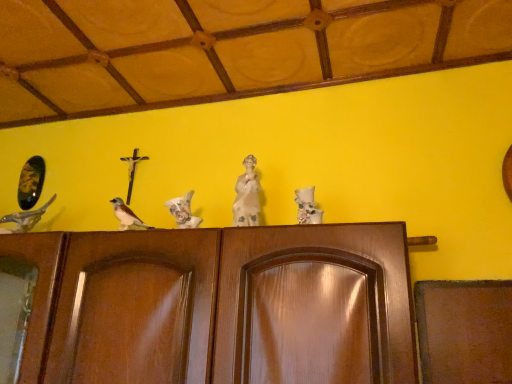
Describe the element at coordinates (247, 196) in the screenshot. Image resolution: width=512 pixels, height=384 pixels. I see `white porcelain statue at center` at that location.

Find the location of `brown matte bird at center, the 2th bird positioned from the left`. brown matte bird at center, the 2th bird positioned from the left is located at coordinates (127, 217).

Considering the sizes of objects brown matte bird at center, the second bird from the right, and white porcelain statue at center in the image provided, who is shorter, brown matte bird at center, the second bird from the right, or white porcelain statue at center?

brown matte bird at center, the second bird from the right, is shorter.

Is brown matte bird at center, the second bird from the right, not close to white porcelain statue at center?

No, brown matte bird at center, the second bird from the right, is in close proximity to white porcelain statue at center.

Can you confirm if brown matte bird at center, the 2th bird positioned from the left, is thinner than white porcelain statue at center?

Incorrect, the width of brown matte bird at center, the 2th bird positioned from the left, is not less than that of white porcelain statue at center.

Which object is thinner, brown matte bird at center, the 2th bird positioned from the left, or shiny metallic bird at left, the third bird from the right?

brown matte bird at center, the 2th bird positioned from the left, is thinner.

Is brown matte bird at center, the 2th bird positioned from the left, touching shiny metallic bird at left, the third bird from the right?

No, brown matte bird at center, the 2th bird positioned from the left, is not with shiny metallic bird at left, the third bird from the right.

Find the location of a particular element. This screenshot has height=384, width=512. the 1st bird in front of the shiny metallic bird at left, which is the first bird from left to right, counting from the anchor's position is located at coordinates (127, 217).

Is brown matte bird at center, the second bird from the right, to the left or to the right of shiny metallic bird at left, which is the first bird from left to right, in the image?

Based on their positions, brown matte bird at center, the second bird from the right, is located to the right of shiny metallic bird at left, which is the first bird from left to right.

Between point (121, 227) and point (186, 222), which one is positioned behind?

The point (121, 227) is behind.

How distant is brown matte bird at center, the second bird from the right, from white matte bird at center, which ranks as the 3th bird in left-to-right order?

4.95 inches.

Can you tell me how much brown matte bird at center, the 2th bird positioned from the left, and white matte bird at center, which ranks as the 1th bird in right-to-left order, differ in facing direction?

brown matte bird at center, the 2th bird positioned from the left, and white matte bird at center, which ranks as the 1th bird in right-to-left order, are facing 0.00055 degrees away from each other.

Do you think brown matte bird at center, the second bird from the right, is within white matte bird at center, which ranks as the 1th bird in right-to-left order, or outside of it?

brown matte bird at center, the second bird from the right, lies outside white matte bird at center, which ranks as the 1th bird in right-to-left order.

Is shiny metallic bird at left, the third bird from the right, taller or shorter than brown matte bird at center, the 2th bird positioned from the left?

Considering their sizes, shiny metallic bird at left, the third bird from the right, has more height than brown matte bird at center, the 2th bird positioned from the left.

Which of these two, shiny metallic bird at left, the third bird from the right, or brown matte bird at center, the 2th bird positioned from the left, is wider?

shiny metallic bird at left, the third bird from the right.

Where is `the 1st bird in front when counting from the shiny metallic bird at left, which is the first bird from left to right`? The height and width of the screenshot is (384, 512). the 1st bird in front when counting from the shiny metallic bird at left, which is the first bird from left to right is located at coordinates (127, 217).

Considering the relative sizes of white matte bird at center, which ranks as the 1th bird in right-to-left order, and brown matte bird at center, the 2th bird positioned from the left, in the image provided, is white matte bird at center, which ranks as the 1th bird in right-to-left order, bigger than brown matte bird at center, the 2th bird positioned from the left,?

No, white matte bird at center, which ranks as the 1th bird in right-to-left order, is not bigger than brown matte bird at center, the 2th bird positioned from the left.

At what (x,y) coordinates should I click in order to perform the action: click on bird located on the right of brown matte bird at center, the second bird from the right. Please return your answer as a coordinate pair (x, y). This screenshot has height=384, width=512. Looking at the image, I should click on (183, 211).

Would you say shiny metallic bird at left, the third bird from the right, is outside white porcelain statue at center?

Yes.

From the image's perspective, who appears lower, shiny metallic bird at left, the third bird from the right, or white porcelain statue at center?

→ From the image's view, shiny metallic bird at left, the third bird from the right, is below.

Is point (8, 217) in front of point (250, 193)?

That is False.

Based on the photo, is shiny metallic bird at left, the third bird from the right, not close to white porcelain statue at center?

No, there isn't a large distance between shiny metallic bird at left, the third bird from the right, and white porcelain statue at center.

In the scene shown: Is white porcelain statue at center aimed at white matte bird at center, which ranks as the 1th bird in right-to-left order?

No.

This screenshot has height=384, width=512. Identify the location of sculpture above the white matte bird at center, which ranks as the 3th bird in left-to-right order (from the image's perspective). (247, 196).

Considering the positions of objects white porcelain statue at center and white matte bird at center, which ranks as the 3th bird in left-to-right order, in the image provided, who is behind, white porcelain statue at center or white matte bird at center, which ranks as the 3th bird in left-to-right order,?

white matte bird at center, which ranks as the 3th bird in left-to-right order, is further away from the camera.

Considering the positions of point (252, 197) and point (181, 208), is point (252, 197) closer or farther from the camera than point (181, 208)?

Clearly, point (252, 197) is more distant from the camera than point (181, 208).

Where is `the 2nd bird to the left of the white porcelain statue at center, counting from the anchor's position`? This screenshot has width=512, height=384. the 2nd bird to the left of the white porcelain statue at center, counting from the anchor's position is located at coordinates (127, 217).

There is a shiny metallic bird at left, the third bird from the right. Where is `the 2nd bird below it (from a real-world perspective)`? The image size is (512, 384). the 2nd bird below it (from a real-world perspective) is located at coordinates (127, 217).

Which object lies further to the anchor point shiny metallic bird at left, the third bird from the right, brown matte bird at center, the second bird from the right, or white porcelain statue at center?

The object further to shiny metallic bird at left, the third bird from the right, is white porcelain statue at center.

Estimate the real-world distances between objects in this image. Which object is closer to brown matte bird at center, the second bird from the right, shiny metallic bird at left, the third bird from the right, or white porcelain statue at center?

Based on the image, white porcelain statue at center appears to be nearer to brown matte bird at center, the second bird from the right.

Estimate the real-world distances between objects in this image. Which object is further from white matte bird at center, which ranks as the 3th bird in left-to-right order, shiny metallic bird at left, the third bird from the right, or brown matte bird at center, the 2th bird positioned from the left?

shiny metallic bird at left, the third bird from the right, is positioned further to the anchor white matte bird at center, which ranks as the 3th bird in left-to-right order.

Looking at the image, which one is located further to shiny metallic bird at left, the third bird from the right, white porcelain statue at center or brown matte bird at center, the second bird from the right?

Based on the image, white porcelain statue at center appears to be further to shiny metallic bird at left, the third bird from the right.

Looking at the image, which one is located closer to white porcelain statue at center, shiny metallic bird at left, the third bird from the right, or brown matte bird at center, the 2th bird positioned from the left?

brown matte bird at center, the 2th bird positioned from the left, is positioned closer to the anchor white porcelain statue at center.

Estimate the real-world distances between objects in this image. Which object is closer to shiny metallic bird at left, the third bird from the right, white porcelain statue at center or white matte bird at center, which ranks as the 3th bird in left-to-right order?

white matte bird at center, which ranks as the 3th bird in left-to-right order, is positioned closer to the anchor shiny metallic bird at left, the third bird from the right.

From the image, which object appears to be farther from white porcelain statue at center, white matte bird at center, which ranks as the 1th bird in right-to-left order, or brown matte bird at center, the 2th bird positioned from the left?

brown matte bird at center, the 2th bird positioned from the left.

Which object lies further to the anchor point shiny metallic bird at left, which is the first bird from left to right, white matte bird at center, which ranks as the 1th bird in right-to-left order, or brown matte bird at center, the 2th bird positioned from the left?

white matte bird at center, which ranks as the 1th bird in right-to-left order, is further to shiny metallic bird at left, which is the first bird from left to right.

Where is `bird between shiny metallic bird at left, the third bird from the right, and white matte bird at center, which ranks as the 3th bird in left-to-right order, in the horizontal direction`? Image resolution: width=512 pixels, height=384 pixels. bird between shiny metallic bird at left, the third bird from the right, and white matte bird at center, which ranks as the 3th bird in left-to-right order, in the horizontal direction is located at coordinates (127, 217).

The width and height of the screenshot is (512, 384). Identify the location of bird between brown matte bird at center, the 2th bird positioned from the left, and white porcelain statue at center. (183, 211).